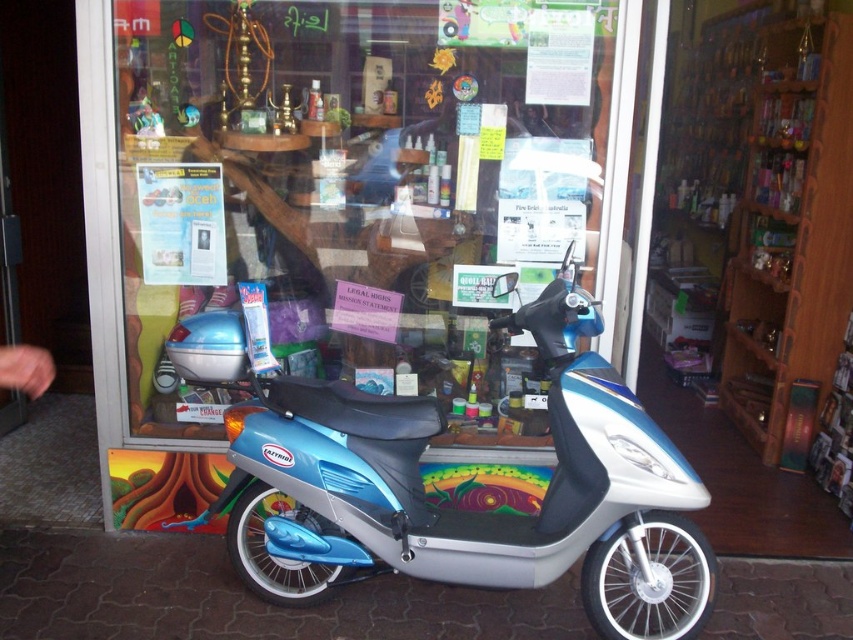
Is transparent glass door at center below metallic blue scooter at center?

Incorrect, transparent glass door at center is not positioned below metallic blue scooter at center.

Is point (125, 182) closer to viewer compared to point (642, 557)?

No, it is behind (642, 557).

Is point (503, 445) closer to camera compared to point (277, 513)?

No.

Locate an element on the screen. The width and height of the screenshot is (853, 640). transparent glass door at center is located at coordinates (344, 214).